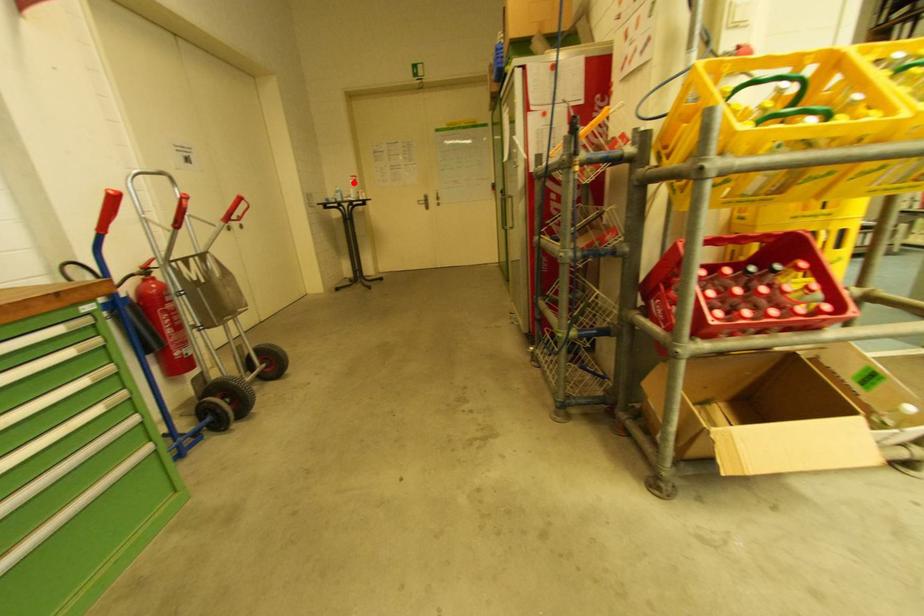
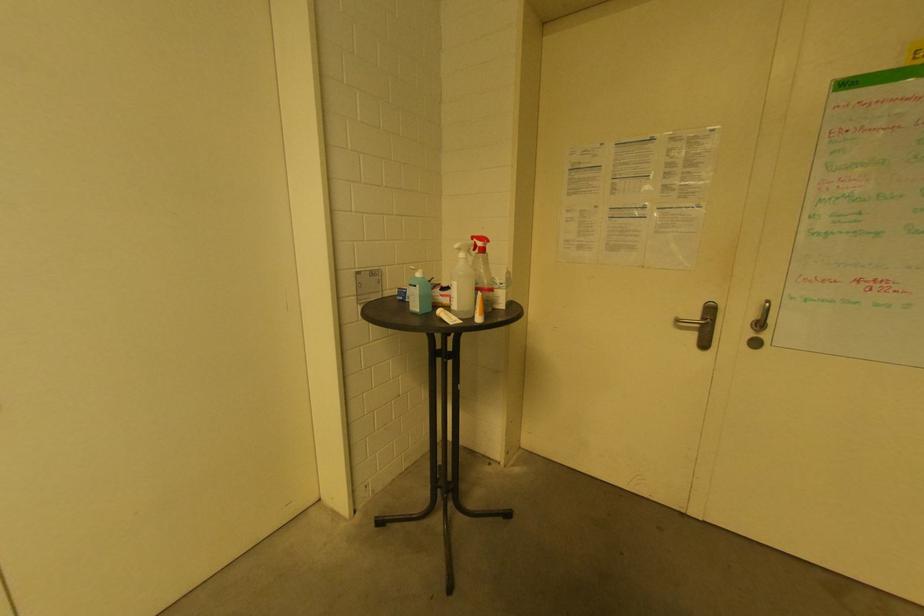
Locate, in the second image, the point that corresponds to the highlighted location in the first image.

(464, 256)